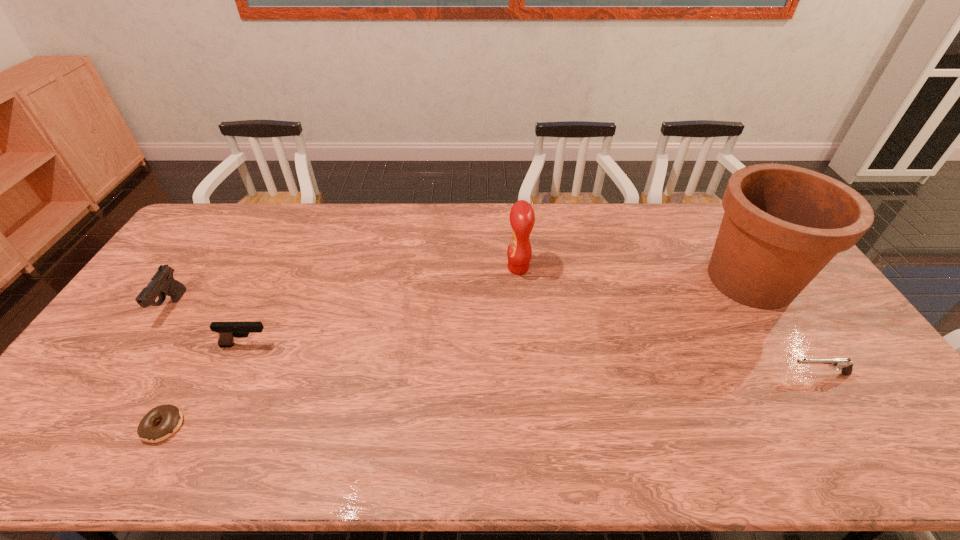
This screenshot has width=960, height=540. I want to click on unoccupied position between the tallest object and the fourth farthest object, so click(498, 313).

I want to click on object that ranks as the fifth closest to the rightmost pistol, so click(162, 283).

Where is `the closest object to the second nearest pistol`? the closest object to the second nearest pistol is located at coordinates (171, 417).

Point out which pistol is positioned as the second nearest to the doughnut. Please provide its 2D coordinates. Your answer should be formatted as a tuple, i.e. [(x, y)], where the tuple contains the x and y coordinates of a point satisfying the conditions above.

[(162, 283)]

Identify which pistol is the second closest to the shortest pistol. Please provide its 2D coordinates. Your answer should be formatted as a tuple, i.e. [(x, y)], where the tuple contains the x and y coordinates of a point satisfying the conditions above.

[(162, 283)]

What are the coordinates of `vacant area in the image that satisfies the following two spatial constraints: 1. on the front side of the tallest object; 2. on the front-facing side of the third shortest object` in the screenshot? It's located at 791,345.

Find the location of a particular element. vacant area in the image that satisfies the following two spatial constraints: 1. on the label side of the fourth object from left to right; 2. at the barrel of the leftmost object is located at coordinates pyautogui.click(x=521, y=306).

Identify the location of free region that satisfies the following two spatial constraints: 1. on the label side of the condiment; 2. on the right side of the flowerpot. The height and width of the screenshot is (540, 960). (x=519, y=280).